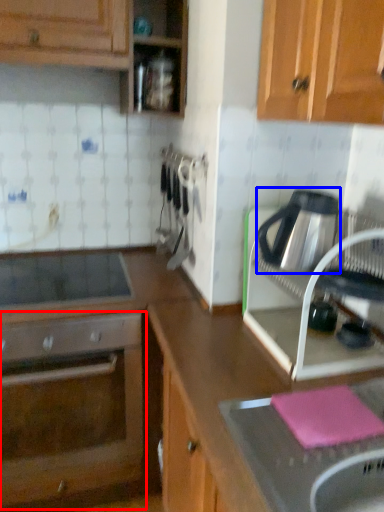
Question: Which object is further to the camera taking this photo, oven (highlighted by a red box) or kitchen appliance (highlighted by a blue box)?

Choices:
 (A) oven
 (B) kitchen appliance

Answer: (A)